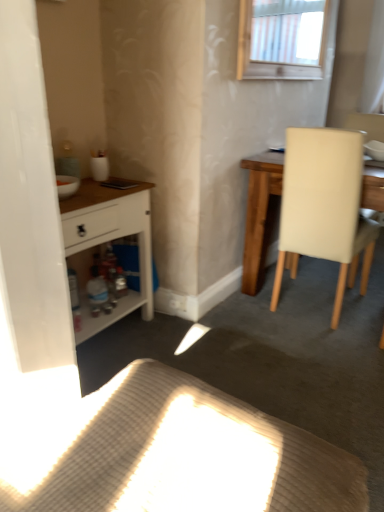
Locate an element on the screen. This screenshot has height=512, width=384. white glossy bowl at upper right is located at coordinates (375, 150).

Identify the location of white matte cabinet at left. The image size is (384, 512). (110, 240).

Consider the image. What is the approximate width of white matte cabinet at left?

white matte cabinet at left is 14.27 inches wide.

The image size is (384, 512). Describe the element at coordinates (324, 208) in the screenshot. I see `beige leather chair at right` at that location.

The height and width of the screenshot is (512, 384). In order to click on transparent plastic screen door at left in this screenshot , I will do `click(30, 200)`.

Can you see woven fabric cushion at lower center touching transparent plastic screen door at left?

No, woven fabric cushion at lower center is not making contact with transparent plastic screen door at left.

From the image's perspective, is woven fabric cushion at lower center above or below transparent plastic screen door at left?

Clearly, from the image's perspective, woven fabric cushion at lower center is below transparent plastic screen door at left.

You are a GUI agent. You are given a task and a screenshot of the screen. Output one action in this format:
    pyautogui.click(x=<x>, y=<y>)
    Task: Click on the screen door on the left side of woven fabric cushion at lower center
    
    Given the screenshot: What is the action you would take?
    pyautogui.click(x=30, y=200)

Which is behind, woven fabric cushion at lower center or beige leather chair at right?

beige leather chair at right is further from the camera.

Would you say beige leather chair at right is part of woven fabric cushion at lower center's contents?

No.

Does woven fabric cushion at lower center have a greater width compared to beige leather chair at right?

Correct, the width of woven fabric cushion at lower center exceeds that of beige leather chair at right.

Which is more to the left, woven fabric cushion at lower center or beige leather chair at right?

woven fabric cushion at lower center is more to the left.

In terms of height, does beige leather chair at right look taller or shorter compared to white glossy bowl at upper right?

Considering their sizes, beige leather chair at right has more height than white glossy bowl at upper right.

How many degrees apart are the facing directions of beige leather chair at right and white glossy bowl at upper right?

The facing directions of beige leather chair at right and white glossy bowl at upper right are 92.7 degrees apart.

I want to click on bowl that is above the beige leather chair at right (from a real-world perspective), so click(x=375, y=150).

Between beige leather chair at right and white glossy bowl at upper right, which one has larger size?

With larger size is beige leather chair at right.

Looking at this image, would you say white glossy bowl at upper right contains beige leather chair at right?

No, beige leather chair at right is not a part of white glossy bowl at upper right.

In the image, there is a white glossy bowl at upper right. Where is `chair below it (from the image's perspective)`? The image size is (384, 512). chair below it (from the image's perspective) is located at coordinates click(x=324, y=208).

Looking at this image, which is nearer, (376, 143) or (288, 140)?

Point (376, 143) appears to be farther away from the viewer than point (288, 140).

Is white glossy bowl at upper right aimed at beige leather chair at right?

Yes.

From a real-world perspective, which object rests below the other?

white matte cabinet at left, from a real-world perspective.

Locate an element on the screen. bowl that appears behind the white matte cabinet at left is located at coordinates (375, 150).

Does white matte cabinet at left come in front of white glossy bowl at upper right?

Yes, the depth of white matte cabinet at left is less than that of white glossy bowl at upper right.

From the image's perspective, between white matte cabinet at left and white glossy bowl at upper right, who is located below?

white matte cabinet at left appears lower in the image.

Considering the sizes of white matte cabinet at left and beige leather chair at right in the image, is white matte cabinet at left wider or thinner than beige leather chair at right?

Clearly, white matte cabinet at left has less width compared to beige leather chair at right.

This screenshot has height=512, width=384. I want to click on cabinetry below the beige leather chair at right (from a real-world perspective), so click(110, 240).

Considering the relative positions of white matte cabinet at left and beige leather chair at right in the image provided, is white matte cabinet at left to the right of beige leather chair at right from the viewer's perspective?

No, white matte cabinet at left is not to the right of beige leather chair at right.

Is white matte cabinet at left facing towards beige leather chair at right?

No.

Does woven fabric cushion at lower center turn towards white glossy bowl at upper right?

No, woven fabric cushion at lower center is not facing towards white glossy bowl at upper right.

Does woven fabric cushion at lower center have a smaller size compared to white glossy bowl at upper right?

No, woven fabric cushion at lower center is not smaller than white glossy bowl at upper right.

Is woven fabric cushion at lower center inside or outside of white glossy bowl at upper right?

woven fabric cushion at lower center is outside white glossy bowl at upper right.

Is woven fabric cushion at lower center at the right side of white glossy bowl at upper right?

Incorrect, woven fabric cushion at lower center is not on the right side of white glossy bowl at upper right.

Locate an element on the screen. The image size is (384, 512). plain lying on the right of transparent plastic screen door at left is located at coordinates (179, 455).

At what (x,y) coordinates should I click in order to perform the action: click on plain below the beige leather chair at right (from a real-world perspective). Please return your answer as a coordinate pair (x, y). Looking at the image, I should click on (179, 455).

Which object lies further to the anchor point white glossy bowl at upper right, transparent plastic screen door at left or white matte cabinet at left?

transparent plastic screen door at left is positioned further to the anchor white glossy bowl at upper right.

From the image, which object appears to be nearer to white matte cabinet at left, beige leather chair at right or white glossy bowl at upper right?

beige leather chair at right is closer to white matte cabinet at left.

Considering their positions, is transparent plastic screen door at left positioned closer to beige leather chair at right than white matte cabinet at left?

Among the two, white matte cabinet at left is located nearer to beige leather chair at right.

Estimate the real-world distances between objects in this image. Which object is closer to beige leather chair at right, woven fabric cushion at lower center or white matte cabinet at left?

Based on the image, white matte cabinet at left appears to be nearer to beige leather chair at right.

Considering their positions, is transparent plastic screen door at left positioned closer to woven fabric cushion at lower center than white matte cabinet at left?

Among the two, transparent plastic screen door at left is located nearer to woven fabric cushion at lower center.

In the scene shown: Estimate the real-world distances between objects in this image. Which object is closer to white glossy bowl at upper right, woven fabric cushion at lower center or white matte cabinet at left?

The object closer to white glossy bowl at upper right is white matte cabinet at left.

Estimate the real-world distances between objects in this image. Which object is closer to transparent plastic screen door at left, beige leather chair at right or white glossy bowl at upper right?

Among the two, beige leather chair at right is located nearer to transparent plastic screen door at left.

Which object lies nearer to the anchor point beige leather chair at right, white matte cabinet at left or woven fabric cushion at lower center?

Based on the image, white matte cabinet at left appears to be nearer to beige leather chair at right.

You are a GUI agent. You are given a task and a screenshot of the screen. Output one action in this format:
    pyautogui.click(x=<x>, y=<y>)
    Task: Click on the screen door located between woven fabric cushion at lower center and white glossy bowl at upper right in the depth direction
    
    Given the screenshot: What is the action you would take?
    pyautogui.click(x=30, y=200)

Locate an element on the screen. chair located between woven fabric cushion at lower center and white glossy bowl at upper right in the depth direction is located at coordinates pyautogui.click(x=324, y=208).

You are a GUI agent. You are given a task and a screenshot of the screen. Output one action in this format:
    pyautogui.click(x=<x>, y=<y>)
    Task: Click on the screen door between woven fabric cushion at lower center and beige leather chair at right from front to back
    This screenshot has width=384, height=512.
    Given the screenshot: What is the action you would take?
    pyautogui.click(x=30, y=200)

Locate an element on the screen. cabinetry positioned between woven fabric cushion at lower center and beige leather chair at right from near to far is located at coordinates pos(110,240).